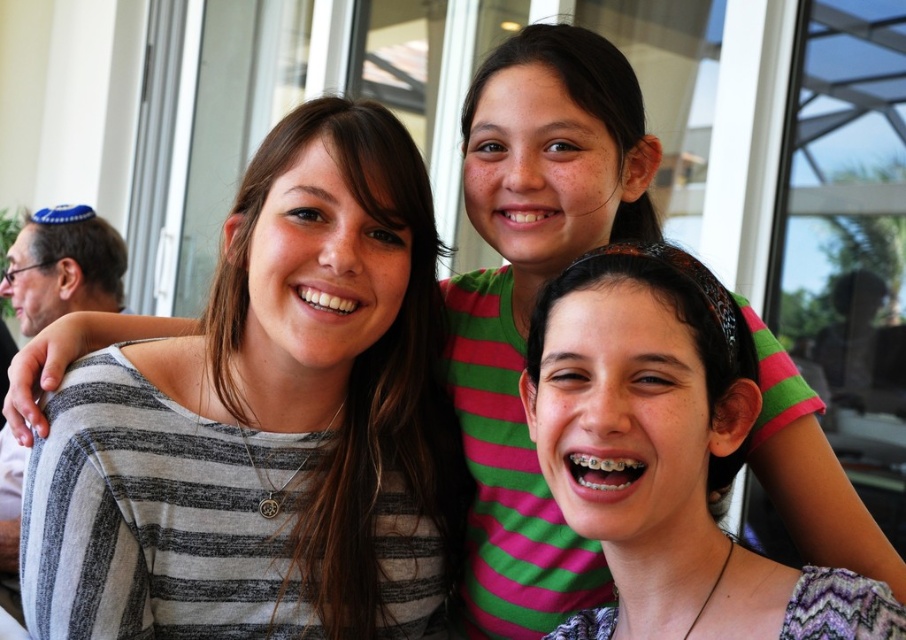
Does gray striped shirt at upper left have a lesser height compared to multicolored woven headband at center?

No, gray striped shirt at upper left is not shorter than multicolored woven headband at center.

Which is in front, point (152, 365) or point (717, 554)?

Point (717, 554) is in front.

The height and width of the screenshot is (640, 906). I want to click on gray striped shirt at upper left, so click(x=267, y=422).

Consider the image. Is multicolored woven headband at center to the left of blue fabric kippah at upper left from the viewer's perspective?

Incorrect, multicolored woven headband at center is not on the left side of blue fabric kippah at upper left.

Is point (571, 412) less distant than point (105, 252)?

That is True.

You are a GUI agent. You are given a task and a screenshot of the screen. Output one action in this format:
    pyautogui.click(x=<x>, y=<y>)
    Task: Click on the multicolored woven headband at center
    
    Given the screenshot: What is the action you would take?
    pyautogui.click(x=661, y=451)

Can you confirm if gray striped shirt at upper left is positioned to the left of blue fabric kippah at upper left?

In fact, gray striped shirt at upper left is to the right of blue fabric kippah at upper left.

Which of these two, gray striped shirt at upper left or blue fabric kippah at upper left, stands shorter?

blue fabric kippah at upper left is shorter.

The width and height of the screenshot is (906, 640). I want to click on gray striped shirt at upper left, so click(x=267, y=422).